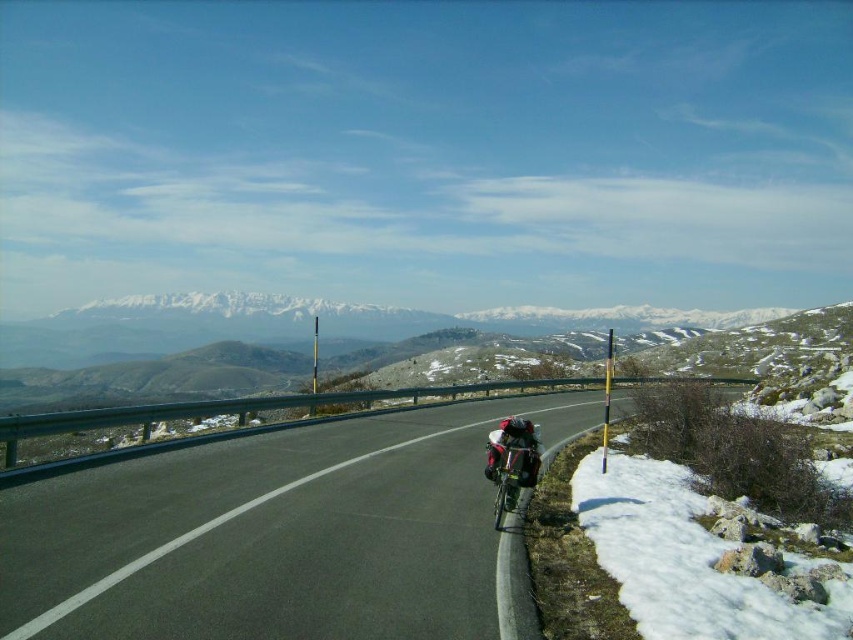
You are a hiker standing on the asphalt road at center and want to place a shiny metallic backpack at center on the ground. Which object is closer to you so you can easily reach it?

The asphalt road at center is closer to the viewer than the shiny metallic backpack at center, so you can easily reach the asphalt road at center first.

You are a hiker planning to walk along the asphalt road at center. There is a shiny metallic backpack at center in your path. Can you walk around it without stepping off the road?

The asphalt road at center is taller than shiny metallic backpack at center, so the backpack is below the road level. Therefore, you can walk around it without leaving the road.